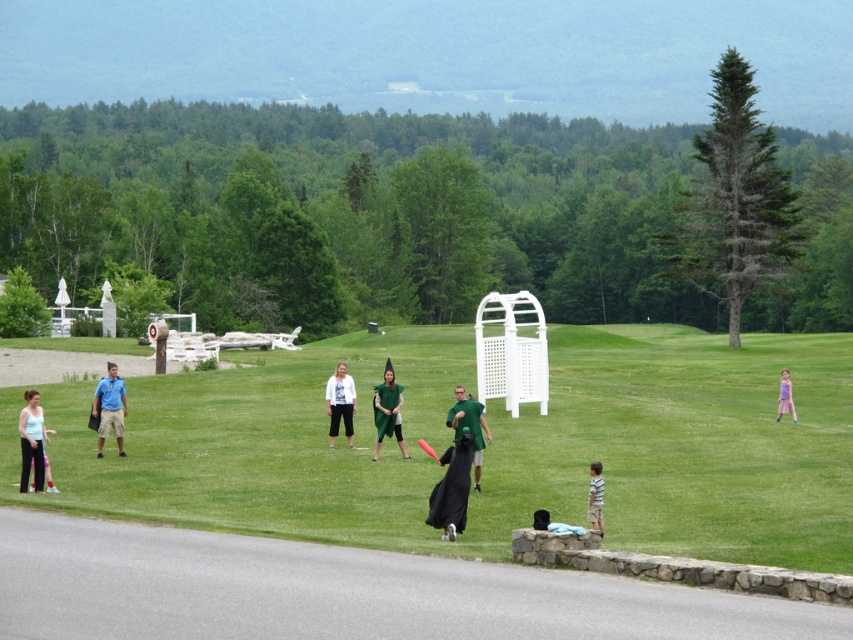
Can you confirm if green matte wizard hat at center is wider than light blue striped shirt at lower right?

Correct, the width of green matte wizard hat at center exceeds that of light blue striped shirt at lower right.

Can you confirm if green matte wizard hat at center is thinner than light blue striped shirt at lower right?

In fact, green matte wizard hat at center might be wider than light blue striped shirt at lower right.

The height and width of the screenshot is (640, 853). I want to click on green matte wizard hat at center, so click(469, 428).

Does point (550, 404) come closer to viewer compared to point (776, 404)?

Yes, it is in front of point (776, 404).

Which of these two, green fabric dress at center or purple satin dress at right, stands shorter?

With less height is purple satin dress at right.

What do you see at coordinates (486, 448) in the screenshot? This screenshot has height=640, width=853. I see `green fabric dress at center` at bounding box center [486, 448].

The image size is (853, 640). In order to click on green fabric dress at center in this screenshot , I will do `click(486, 448)`.

Who is lower down, green fabric dress at center or black matte dress at center?

black matte dress at center is lower down.

Who is more forward, (811, 460) or (447, 502)?

Point (447, 502)

Which is in front, point (695, 518) or point (440, 490)?

Point (440, 490) is in front.

Where is `green fabric dress at center`? The height and width of the screenshot is (640, 853). green fabric dress at center is located at coordinates (486, 448).